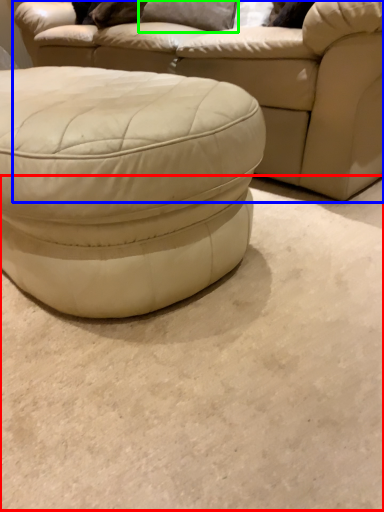
Question: Which is farther away from concrete (highlighted by a red box)? studio couch (highlighted by a blue box) or pillow (highlighted by a green box)?

Choices:
 (A) studio couch
 (B) pillow

Answer: (B)